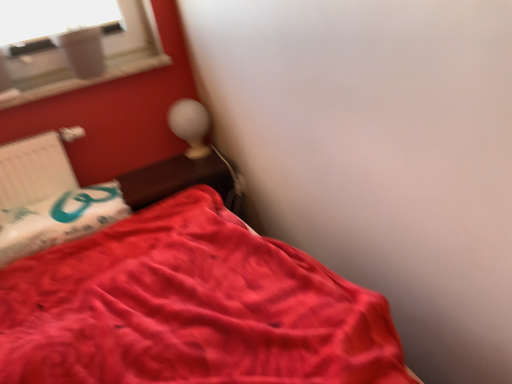
Question: Does white plastic radiator at left have a lesser height compared to matte white table lamp at upper center?

Choices:
 (A) yes
 (B) no

Answer: (B)

Question: Is white plastic radiator at left positioned behind matte white table lamp at upper center?

Choices:
 (A) no
 (B) yes

Answer: (A)

Question: From a real-world perspective, is white plastic radiator at left beneath matte white table lamp at upper center?

Choices:
 (A) no
 (B) yes

Answer: (A)

Question: Is white plastic radiator at left positioned with its back to matte white table lamp at upper center?

Choices:
 (A) no
 (B) yes

Answer: (A)

Question: From a real-world perspective, does white plastic radiator at left stand above matte white table lamp at upper center?

Choices:
 (A) yes
 (B) no

Answer: (A)

Question: Looking at their shapes, would you say wooden table at upper center is wider or thinner than matte white table lamp at upper center?

Choices:
 (A) thin
 (B) wide

Answer: (B)

Question: Relative to matte white table lamp at upper center, is wooden table at upper center in front or behind?

Choices:
 (A) front
 (B) behind

Answer: (A)

Question: In the image, is wooden table at upper center on the left side or the right side of matte white table lamp at upper center?

Choices:
 (A) left
 (B) right

Answer: (A)

Question: Is point (168, 183) positioned closer to the camera than point (202, 130)?

Choices:
 (A) closer
 (B) farther

Answer: (A)

Question: Considering the positions of point (53, 150) and point (373, 292), is point (53, 150) closer or farther from the camera than point (373, 292)?

Choices:
 (A) farther
 (B) closer

Answer: (A)

Question: Do you think white plastic radiator at left is within satin red bed at lower left, or outside of it?

Choices:
 (A) outside
 (B) inside

Answer: (A)

Question: Is white plastic radiator at left taller or shorter than satin red bed at lower left?

Choices:
 (A) short
 (B) tall

Answer: (A)

Question: In terms of size, does white plastic radiator at left appear bigger or smaller than satin red bed at lower left?

Choices:
 (A) big
 (B) small

Answer: (B)

Question: From the image's perspective, is satin red bed at lower left positioned above or below white plastic radiator at left?

Choices:
 (A) below
 (B) above

Answer: (A)

Question: Considering the positions of point (50, 259) and point (23, 142), is point (50, 259) closer or farther from the camera than point (23, 142)?

Choices:
 (A) closer
 (B) farther

Answer: (A)